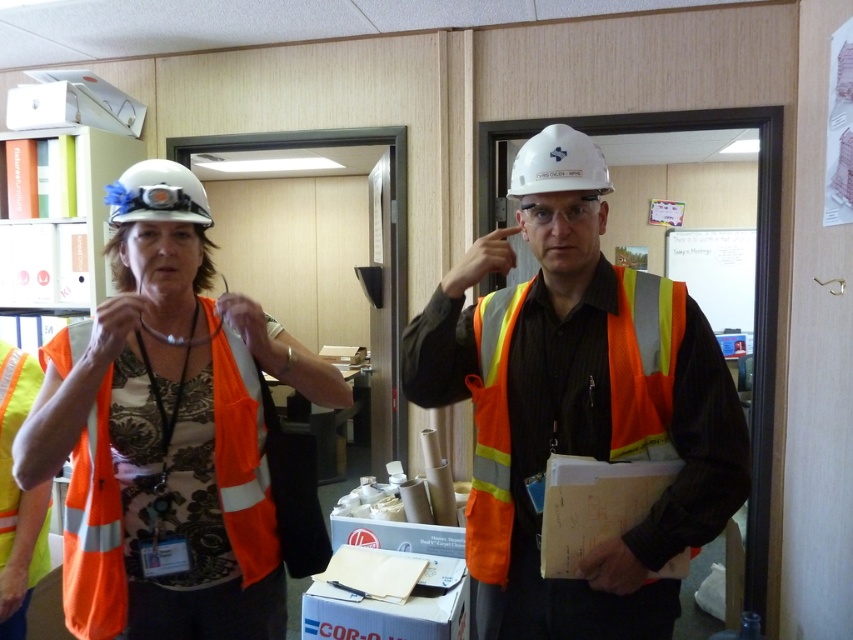
Is orange reflective vest at center shorter than white hard hat at center?

No.

Between orange reflective vest at center and white hard hat at center, which one appears on the right side from the viewer's perspective?

Positioned to the right is white hard hat at center.

Does point (219, 600) come farther from viewer compared to point (573, 180)?

Yes, it is behind point (573, 180).

The image size is (853, 640). Find the location of `orange reflective vest at center`. orange reflective vest at center is located at coordinates (167, 448).

Between point (44, 394) and point (498, 509), which one is positioned in front?

Point (44, 394)

Between point (97, 529) and point (639, 275), which one is positioned behind?

Point (639, 275)

Identify the location of orange reflective vest at center. The width and height of the screenshot is (853, 640). (167, 448).

Does point (569, 188) come behind point (146, 211)?

No, (569, 188) is closer to viewer.

Between white hard hat at center and white hard hat at upper center, which one appears on the left side from the viewer's perspective?

white hard hat at upper center

Describe the element at coordinates (558, 163) in the screenshot. I see `white hard hat at center` at that location.

You are a GUI agent. You are given a task and a screenshot of the screen. Output one action in this format:
    pyautogui.click(x=<x>, y=<y>)
    Task: Click on the white hard hat at center
    This screenshot has width=853, height=640.
    Given the screenshot: What is the action you would take?
    pyautogui.click(x=558, y=163)